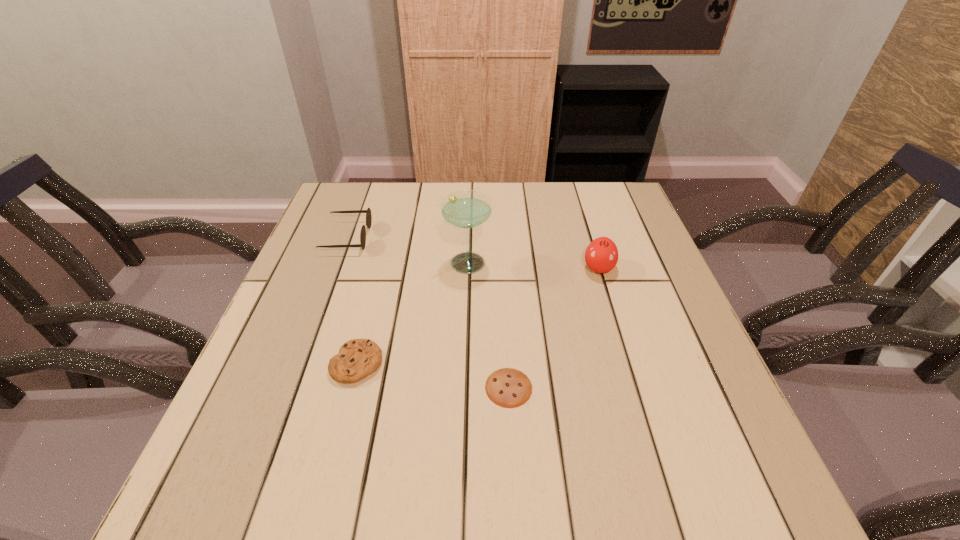
Identify the location of free space between the martini and the second tallest object. This screenshot has height=540, width=960. (533, 265).

You are a GUI agent. You are given a task and a screenshot of the screen. Output one action in this format:
    pyautogui.click(x=<x>, y=<y>)
    Task: Click on the free space between the fourth tallest object and the shorter cookie
    
    Given the screenshot: What is the action you would take?
    pyautogui.click(x=433, y=375)

The height and width of the screenshot is (540, 960). I want to click on free point between the second shortest object and the martini, so click(x=412, y=312).

Image resolution: width=960 pixels, height=540 pixels. What are the coordinates of `vacant space that is in between the sunglasses and the second object from left to right` in the screenshot? It's located at (352, 300).

Where is `vacant point located between the martini and the third tallest object`? The height and width of the screenshot is (540, 960). vacant point located between the martini and the third tallest object is located at coordinates point(406,249).

Identify the location of object that can be found as the closest to the tallest object. (368, 212).

Identify which object is the second nearest to the sunglasses. Please provide its 2D coordinates. Your answer should be formatted as a tuple, i.e. [(x, y)], where the tuple contains the x and y coordinates of a point satisfying the conditions above.

[(357, 358)]

Where is `free location that satisfies the following two spatial constraints: 1. on the front-facing side of the leftmost object; 2. on the right side of the shorter cookie`? This screenshot has height=540, width=960. free location that satisfies the following two spatial constraints: 1. on the front-facing side of the leftmost object; 2. on the right side of the shorter cookie is located at coordinates (292, 388).

The height and width of the screenshot is (540, 960). Identify the location of blank space that satisfies the following two spatial constraints: 1. on the front-facing side of the sunglasses; 2. on the left side of the right cookie. (292, 388).

At what (x,y) coordinates should I click in order to perform the action: click on vacant region that satisfies the following two spatial constraints: 1. on the front-facing side of the left cookie; 2. on the right side of the third tallest object. Please return your answer as a coordinate pair (x, y). The height and width of the screenshot is (540, 960). Looking at the image, I should click on (300, 363).